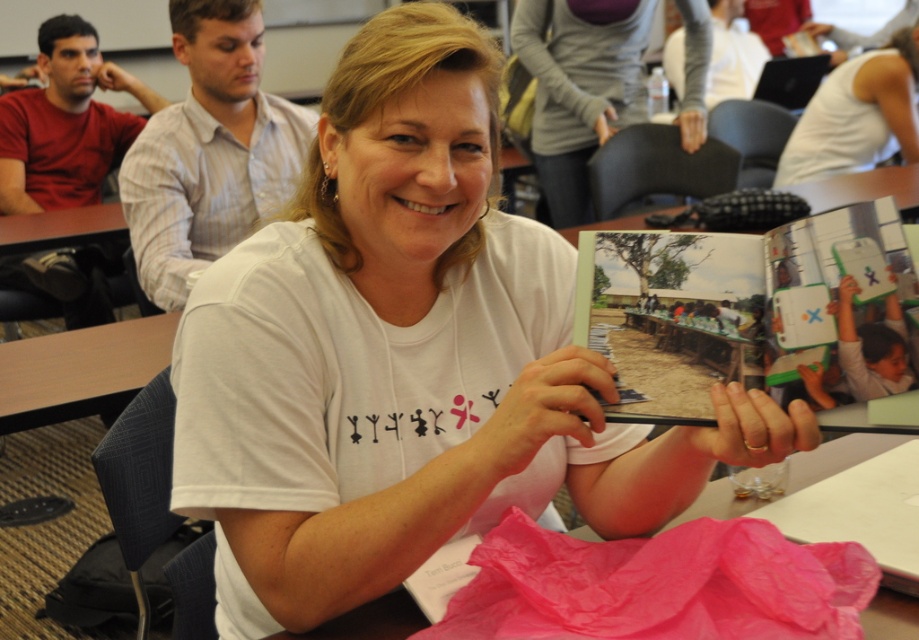
Question: Can you confirm if green plastic book at center is wider than wooden table at lower left?

Choices:
 (A) yes
 (B) no

Answer: (B)

Question: Can you confirm if green plastic book at center is positioned below white matte tank top at upper right?

Choices:
 (A) no
 (B) yes

Answer: (B)

Question: Which object is farther from the camera taking this photo?

Choices:
 (A) wooden table at lower left
 (B) green plastic book at center
 (C) white matte tank top at upper right
 (D) pink plastic bag at lower center

Answer: (C)

Question: Does green plastic book at center appear under wooden table at lower left?

Choices:
 (A) no
 (B) yes

Answer: (A)

Question: Which point is farther to the camera?

Choices:
 (A) pink plastic bag at lower center
 (B) wooden table at lower left

Answer: (B)

Question: Which of the following is the farthest from the observer?

Choices:
 (A) (835, 118)
 (B) (676, 305)
 (C) (94, 369)
 (D) (796, 476)

Answer: (A)